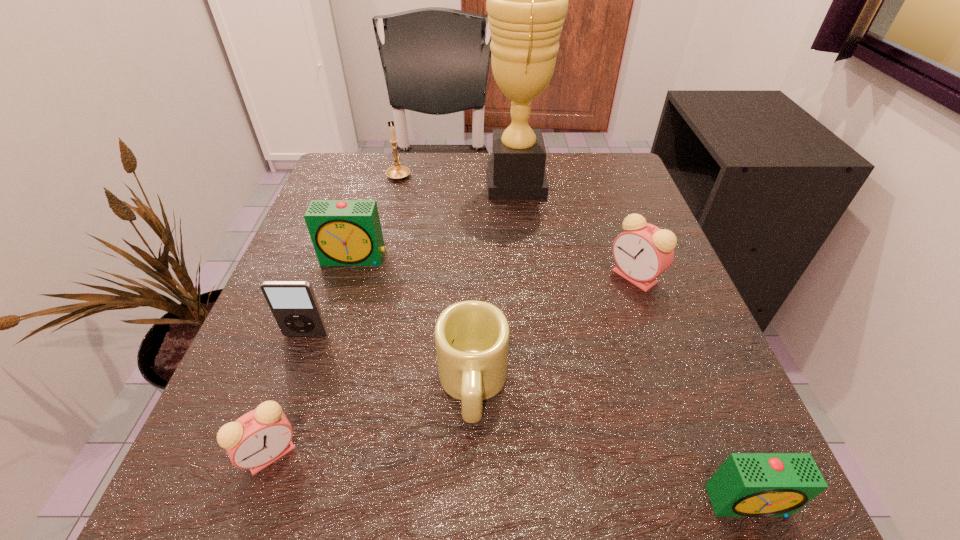
Where is `the third farthest alarm clock`? The width and height of the screenshot is (960, 540). the third farthest alarm clock is located at coordinates (258, 438).

At what (x,y) coordinates should I click in order to perform the action: click on the nearest alarm clock. Please return your answer as a coordinate pair (x, y). The image size is (960, 540). Looking at the image, I should click on (747, 484).

The image size is (960, 540). Find the location of `the nearest object`. the nearest object is located at coordinates (747, 484).

What are the coordinates of `vacant area situated at the front of the tallest object with handles` in the screenshot? It's located at (420, 183).

At what (x,y) coordinates should I click in order to perform the action: click on vacant space located at the front of the tallest object with handles. Please return your answer as a coordinate pair (x, y). Image resolution: width=960 pixels, height=540 pixels. Looking at the image, I should click on (417, 183).

Image resolution: width=960 pixels, height=540 pixels. What are the coordinates of `free space located 0.160m at the front of the tallest object with handles` in the screenshot? It's located at (417, 183).

This screenshot has width=960, height=540. Identify the location of vacant region located on the handle side of the gold candle holder. (404, 152).

Identify the location of free space located 0.050m on the handle side of the gold candle holder. The image size is (960, 540). (403, 156).

This screenshot has height=540, width=960. In order to click on vacant region located on the face of the right pink alarm clock in this screenshot , I will do `click(533, 276)`.

Locate an element on the screen. This screenshot has width=960, height=540. vacant space positioned 0.150m on the face of the right pink alarm clock is located at coordinates (527, 276).